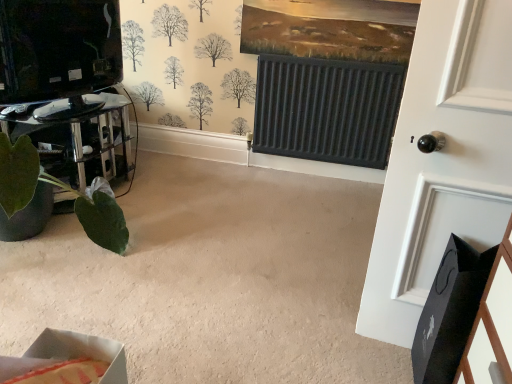
Find the location of a particular element. The height and width of the screenshot is (384, 512). white matte door at right is located at coordinates (442, 160).

Image resolution: width=512 pixels, height=384 pixels. I want to click on green matte plant pot at lower left, so click(x=87, y=141).

Locate an element on the screen. white matte door at right is located at coordinates (442, 160).

This screenshot has width=512, height=384. There is a white matte door at right. Find the location of `cardboard box above it (from a real-world perspective)`. cardboard box above it (from a real-world perspective) is located at coordinates (81, 351).

From the image's perspective, which is above, white matte door at right or cardboard box at lower left?

From the image's view, white matte door at right is above.

Is white matte door at right further to camera compared to cardboard box at lower left?

Yes, it is.

Is white matte door at right far away from cardboard box at lower left?

Yes, white matte door at right is far from cardboard box at lower left.

From the image's perspective, would you say cardboard box at lower left is shown under white matte door at right?

Correct, cardboard box at lower left appears lower than white matte door at right in the image.

In the scene shown: Is cardboard box at lower left far away from white matte door at right?

cardboard box at lower left is positioned a significant distance from white matte door at right.

From the picture: From a real-world perspective, is cardboard box at lower left physically above white matte door at right?

Correct, in the physical world, cardboard box at lower left is higher than white matte door at right.

Considering the relative sizes of green matte plant pot at lower left and cardboard box at lower left in the image provided, is green matte plant pot at lower left smaller than cardboard box at lower left?

Actually, green matte plant pot at lower left might be larger than cardboard box at lower left.

Looking at this image, is green matte plant pot at lower left at the right side of cardboard box at lower left?

Incorrect, green matte plant pot at lower left is not on the right side of cardboard box at lower left.

From a real-world perspective, is green matte plant pot at lower left over cardboard box at lower left?

No, from a real-world perspective, green matte plant pot at lower left is not over cardboard box at lower left

Is cardboard box at lower left taller than green matte plant pot at lower left?

No.

Measure the distance from cardboard box at lower left to green matte plant pot at lower left.

cardboard box at lower left and green matte plant pot at lower left are 7.15 feet apart from each other.

From a real-world perspective, is cardboard box at lower left below green matte plant pot at lower left?

Actually, cardboard box at lower left is physically above green matte plant pot at lower left in the real world.

Between cardboard box at lower left and green matte plant pot at lower left, which one is positioned behind?

green matte plant pot at lower left is further away from the camera.

Is white matte door at right at the back of green matte plant pot at lower left?

No, green matte plant pot at lower left is not facing the opposite direction of white matte door at right.

From the image's perspective, is green matte plant pot at lower left under white matte door at right?

Actually, green matte plant pot at lower left appears above white matte door at right in the image.

Is green matte plant pot at lower left to the left or to the right of white matte door at right in the image?

green matte plant pot at lower left is to the left of white matte door at right.

From a real-world perspective, who is located lower, white matte door at right or green matte plant pot at lower left?

green matte plant pot at lower left is physically lower.

Does white matte door at right have a greater height compared to green matte plant pot at lower left?

Indeed, white matte door at right has a greater height compared to green matte plant pot at lower left.

Considering the sizes of objects white matte door at right and green matte plant pot at lower left in the image provided, who is wider, white matte door at right or green matte plant pot at lower left?

green matte plant pot at lower left is wider.

Consider the image. Is white matte door at right aimed at green matte plant pot at lower left?

No, white matte door at right is not turned towards green matte plant pot at lower left.

Identify the location of cardboard box located on the left of white matte door at right. The width and height of the screenshot is (512, 384). (81, 351).

Where is `door directly beneath the cardboard box at lower left (from a real-world perspective)`? door directly beneath the cardboard box at lower left (from a real-world perspective) is located at coordinates (442, 160).

Estimate the real-world distances between objects in this image. Which object is further from green matte plant pot at lower left, white matte door at right or cardboard box at lower left?

cardboard box at lower left is further to green matte plant pot at lower left.

Based on their spatial positions, is white matte door at right or green matte plant pot at lower left further from cardboard box at lower left?

Among the two, green matte plant pot at lower left is located further to cardboard box at lower left.

When comparing their distances from white matte door at right, does green matte plant pot at lower left or cardboard box at lower left seem closer?

cardboard box at lower left lies closer to white matte door at right than the other object.

From the image, which object appears to be farther from green matte plant pot at lower left, cardboard box at lower left or white matte door at right?

cardboard box at lower left is further to green matte plant pot at lower left.

Based on their spatial positions, is green matte plant pot at lower left or white matte door at right further from cardboard box at lower left?

green matte plant pot at lower left is positioned further to the anchor cardboard box at lower left.

From the image, which object appears to be farther from white matte door at right, cardboard box at lower left or green matte plant pot at lower left?

The object further to white matte door at right is green matte plant pot at lower left.

Where is `cardboard box situated between green matte plant pot at lower left and white matte door at right from left to right`? cardboard box situated between green matte plant pot at lower left and white matte door at right from left to right is located at coordinates (81, 351).